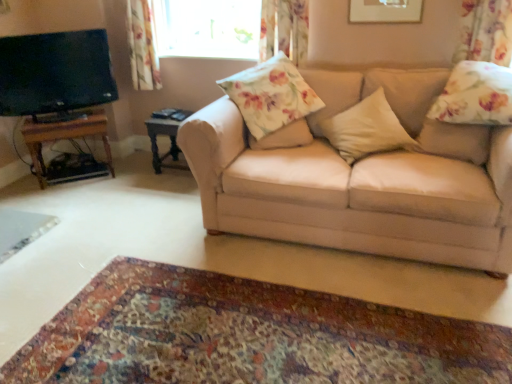
Question: Is floral fabric curtain at upper left, which ranks as the 3th curtain in front-to-back order, not within transparent glass window at upper center?

Choices:
 (A) no
 (B) yes

Answer: (B)

Question: Does floral fabric curtain at upper left, the 1th curtain from the back, lie behind transparent glass window at upper center?

Choices:
 (A) yes
 (B) no

Answer: (B)

Question: From a real-world perspective, is floral fabric curtain at upper left, which ranks as the 3th curtain in front-to-back order, physically above transparent glass window at upper center?

Choices:
 (A) yes
 (B) no

Answer: (B)

Question: Can you confirm if floral fabric curtain at upper left, the 1th curtain from the back, is taller than transparent glass window at upper center?

Choices:
 (A) yes
 (B) no

Answer: (A)

Question: Considering the relative sizes of floral fabric curtain at upper left, the 1th curtain from the back, and transparent glass window at upper center in the image provided, is floral fabric curtain at upper left, the 1th curtain from the back, wider than transparent glass window at upper center?

Choices:
 (A) no
 (B) yes

Answer: (B)

Question: From a real-world perspective, relative to matte black tv at left, is beige fabric pillow at center, positioned as the second pillow in left-to-right order, vertically above or below?

Choices:
 (A) above
 (B) below

Answer: (B)

Question: In terms of width, does beige fabric pillow at center, positioned as the second pillow in left-to-right order, look wider or thinner when compared to matte black tv at left?

Choices:
 (A) wide
 (B) thin

Answer: (A)

Question: From the image's perspective, is beige fabric pillow at center, the second pillow from the right, located above or below matte black tv at left?

Choices:
 (A) above
 (B) below

Answer: (B)

Question: Considering the positions of point (328, 130) and point (0, 69), is point (328, 130) closer or farther from the camera than point (0, 69)?

Choices:
 (A) farther
 (B) closer

Answer: (B)

Question: Is floral fabric pillow at right, the 3th pillow positioned from the left, to the left or to the right of matte black tv at left in the image?

Choices:
 (A) right
 (B) left

Answer: (A)

Question: Does point (496, 119) appear closer or farther from the camera than point (16, 51)?

Choices:
 (A) farther
 (B) closer

Answer: (B)

Question: In the image, is floral fabric pillow at right, the 3th pillow positioned from the left, positioned in front of or behind matte black tv at left?

Choices:
 (A) front
 (B) behind

Answer: (A)

Question: From a real-world perspective, relative to matte black tv at left, is floral fabric pillow at right, placed as the first pillow when sorted from right to left, vertically above or below?

Choices:
 (A) below
 (B) above

Answer: (B)

Question: From a real-world perspective, is beige fabric pillow at center, the second pillow from the right, above or below floral fabric pillow at right, placed as the first pillow when sorted from right to left?

Choices:
 (A) below
 (B) above

Answer: (A)

Question: Is beige fabric pillow at center, positioned as the second pillow in left-to-right order, spatially inside floral fabric pillow at right, placed as the first pillow when sorted from right to left, or outside of it?

Choices:
 (A) inside
 (B) outside

Answer: (B)